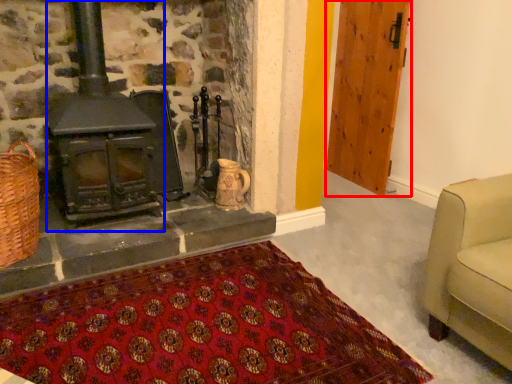
Question: Which object is further to the camera taking this photo, door (highlighted by a red box) or wood burning stove (highlighted by a blue box)?

Choices:
 (A) door
 (B) wood burning stove

Answer: (A)